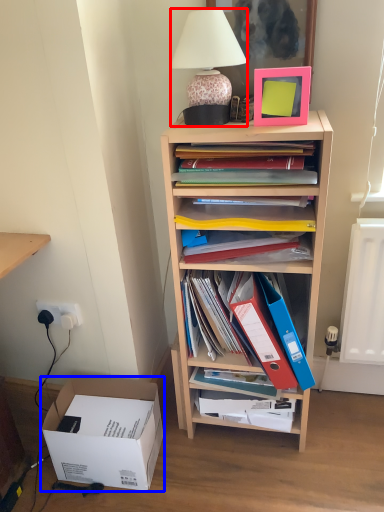
Question: Among these objects, which one is nearest to the camera, lamp (highlighted by a red box) or box (highlighted by a blue box)?

Choices:
 (A) lamp
 (B) box

Answer: (A)